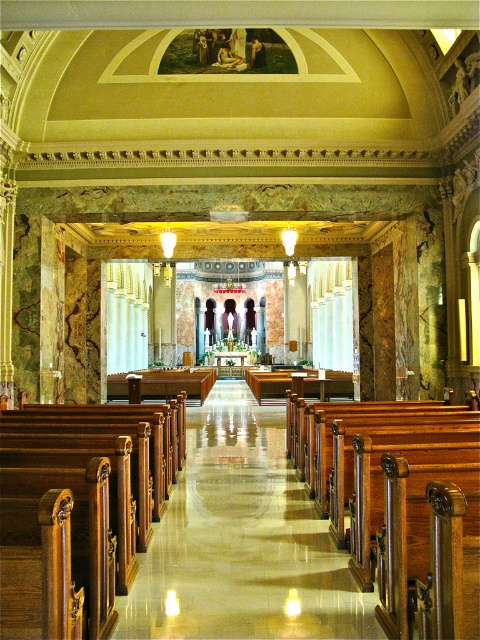
Between polished wood aisle at center and polished wood pews at center, which one is positioned lower?

polished wood aisle at center is lower down.

Can you confirm if polished wood aisle at center is bigger than polished wood pews at center?

Incorrect, polished wood aisle at center is not larger than polished wood pews at center.

This screenshot has height=640, width=480. I want to click on polished wood aisle at center, so click(x=241, y=541).

I want to click on polished wood aisle at center, so click(x=241, y=541).

Can you confirm if polished wood aisle at center is positioned above polished wood church bench at center?

No, polished wood aisle at center is not above polished wood church bench at center.

Is point (206, 632) positioned after point (395, 426)?

No, it is in front of (395, 426).

The image size is (480, 640). Identify the location of polished wood aisle at center. (241, 541).

Can you confirm if polished wood pews at center is thinner than polished wood church bench at center?

No.

Can you confirm if polished wood pews at center is taller than polished wood church bench at center?

Incorrect, polished wood pews at center's height is not larger of polished wood church bench at center's.

The image size is (480, 640). What do you see at coordinates (78, 512) in the screenshot?
I see `polished wood pews at center` at bounding box center [78, 512].

This screenshot has height=640, width=480. I want to click on polished wood pews at center, so click(78, 512).